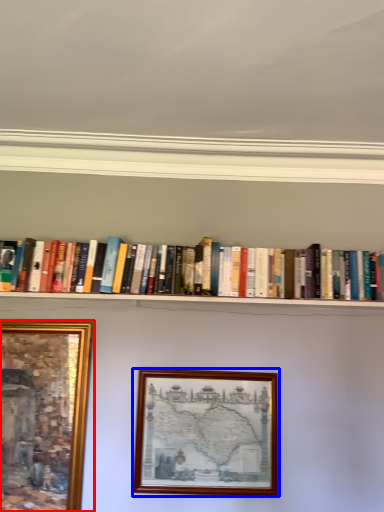
Question: Which object appears farthest to the camera in this image, picture frame (highlighted by a red box) or picture frame (highlighted by a blue box)?

Choices:
 (A) picture frame
 (B) picture frame

Answer: (B)